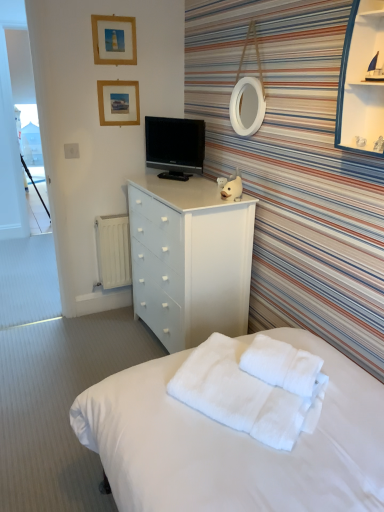
Locate an element on the screen. The height and width of the screenshot is (512, 384). vacant area that is in front of white soft towel at lower center is located at coordinates (279, 397).